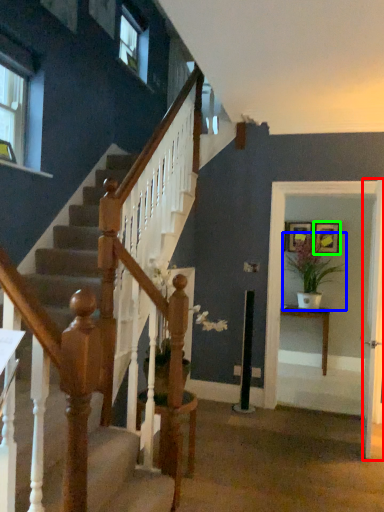
Question: Which is farther away from door (highlighted by a red box)? houseplant (highlighted by a blue box) or picture frame (highlighted by a green box)?

Choices:
 (A) houseplant
 (B) picture frame

Answer: (B)